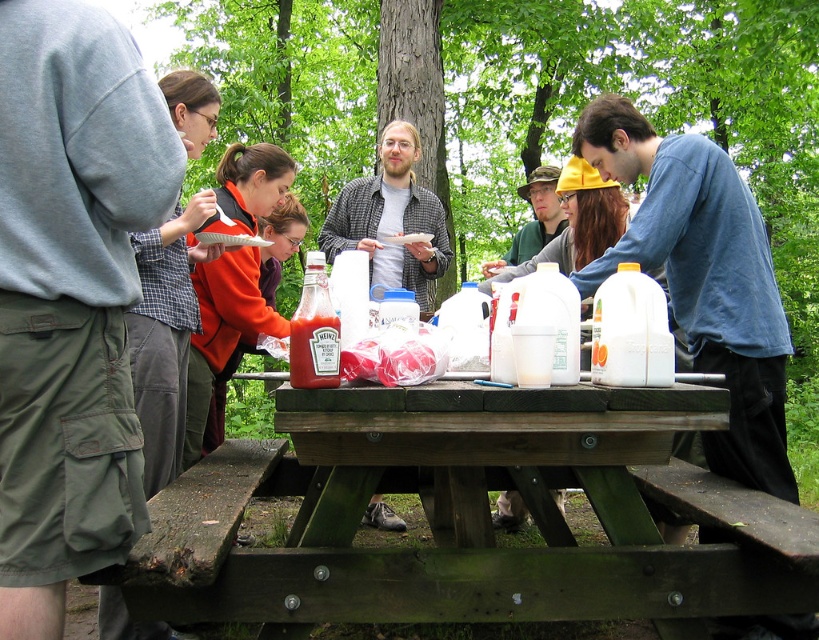
You are a photographer trying to capture a photo of the green wood picnic table at center and the plaid shirt at center. Since you want to focus on both objects equally, which one should you zoom in on more to ensure they appear the same size in the photo?

The green wood picnic table at center is smaller than the plaid shirt at center, so you should zoom in more on the green wood picnic table at center to make it appear larger in the photo and balance their sizes.